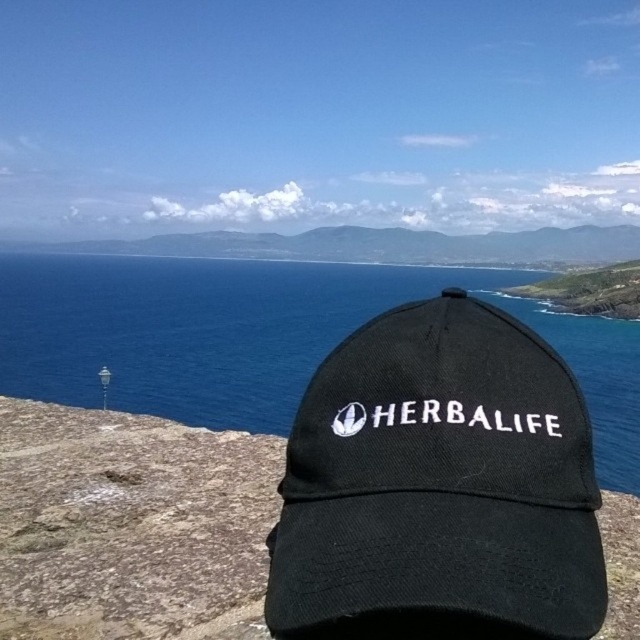
Question: Which point is closer to the camera?

Choices:
 (A) (182, 465)
 (B) (632, 460)

Answer: (A)

Question: Which object is positioned farthest from the blue water at center?

Choices:
 (A) black fabric baseball cap at center
 (B) black fabric cap at center

Answer: (A)

Question: Does black fabric baseball cap at center appear over black fabric cap at center?

Choices:
 (A) no
 (B) yes

Answer: (B)

Question: Among these objects, which one is nearest to the camera?

Choices:
 (A) blue water at center
 (B) black fabric baseball cap at center

Answer: (B)

Question: Does black fabric baseball cap at center have a greater width compared to blue water at center?

Choices:
 (A) no
 (B) yes

Answer: (A)

Question: Considering the relative positions of black fabric baseball cap at center and black fabric cap at center in the image provided, where is black fabric baseball cap at center located with respect to black fabric cap at center?

Choices:
 (A) right
 (B) left

Answer: (A)